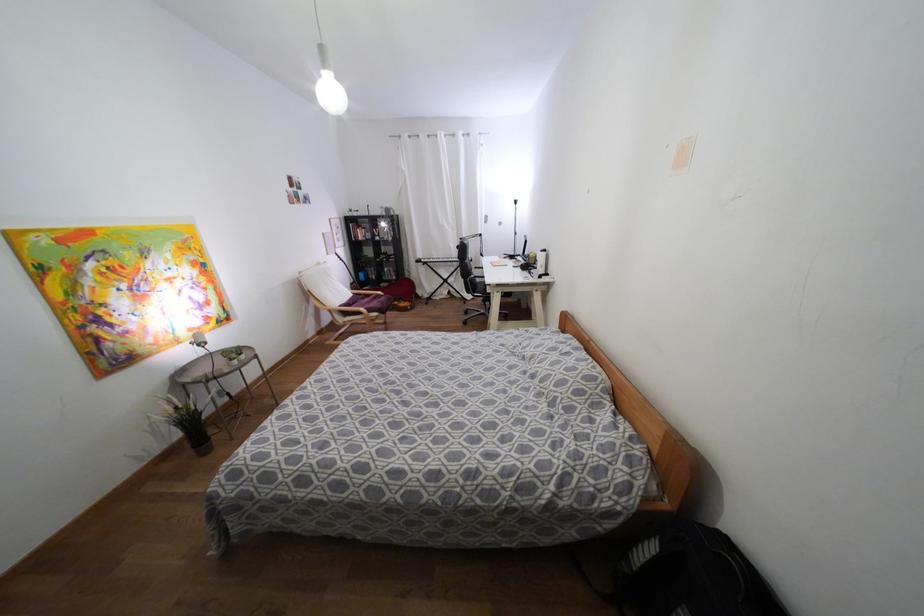
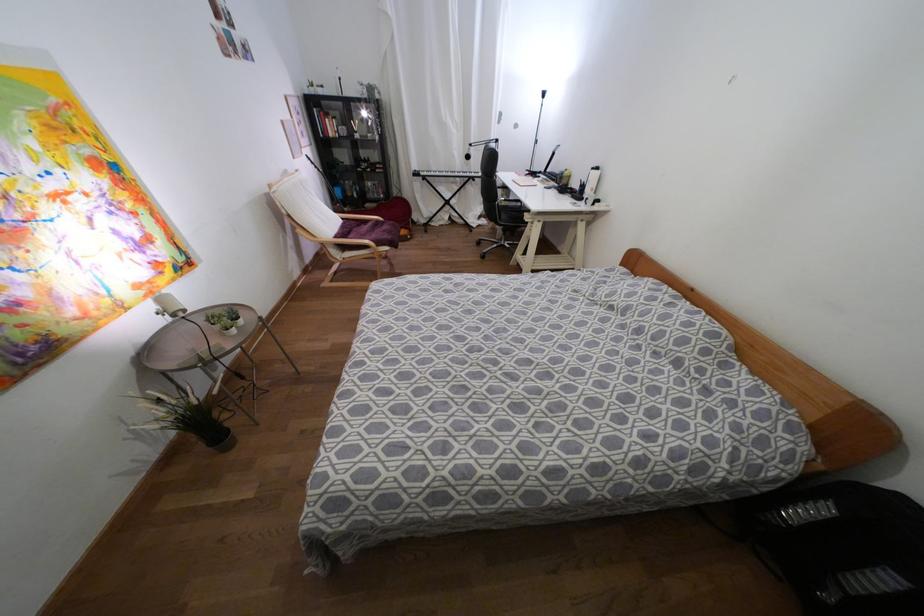
Question: How did the camera likely rotate?

Choices:
 (A) Left
 (B) Right
 (C) Up
 (D) Down

Answer: (D)